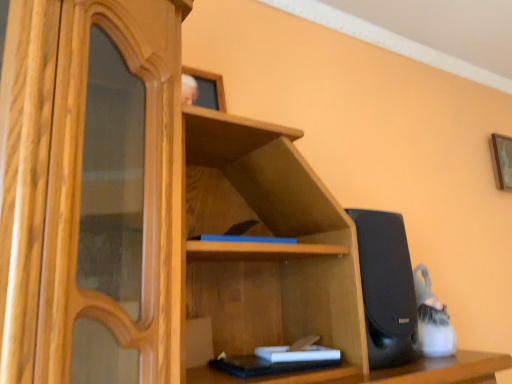
Question: Is white matte book at lower center bigger or smaller than wooden picture frame at upper right?

Choices:
 (A) small
 (B) big

Answer: (A)

Question: From the image's perspective, is white matte book at lower center located above or below wooden picture frame at upper right?

Choices:
 (A) above
 (B) below

Answer: (B)

Question: Is point (327, 355) closer or farther from the camera than point (498, 180)?

Choices:
 (A) closer
 (B) farther

Answer: (A)

Question: From a real-world perspective, relative to white matte book at lower center, is wooden picture frame at upper right vertically above or below?

Choices:
 (A) below
 (B) above

Answer: (B)

Question: Is wooden picture frame at upper right taller or shorter than white matte book at lower center?

Choices:
 (A) tall
 (B) short

Answer: (A)

Question: Do you think wooden picture frame at upper right is within white matte book at lower center, or outside of it?

Choices:
 (A) inside
 (B) outside

Answer: (B)

Question: Is point (493, 160) positioned closer to the camera than point (298, 355)?

Choices:
 (A) closer
 (B) farther

Answer: (B)